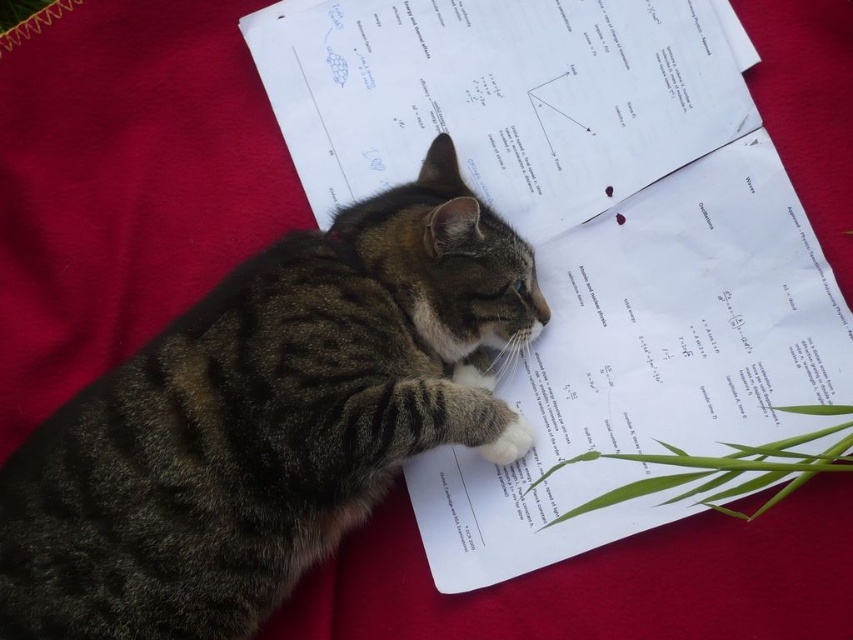
Question: Does tabby fur cat at center appear over white fur at center?

Choices:
 (A) yes
 (B) no

Answer: (A)

Question: Does tabby fur cat at center have a lesser width compared to white fur at center?

Choices:
 (A) no
 (B) yes

Answer: (A)

Question: Considering the real-world distances, which object is farthest from the white fur at center?

Choices:
 (A) tabby fur cat at center
 (B) white paper at center

Answer: (A)

Question: Which point is farther to the camera?

Choices:
 (A) white paper at center
 (B) tabby fur cat at center

Answer: (A)

Question: Which object is closer to the camera taking this photo?

Choices:
 (A) white fur at center
 (B) white paper at center
 (C) tabby fur cat at center

Answer: (C)

Question: Does tabby fur cat at center have a lesser width compared to white fur at center?

Choices:
 (A) no
 (B) yes

Answer: (A)